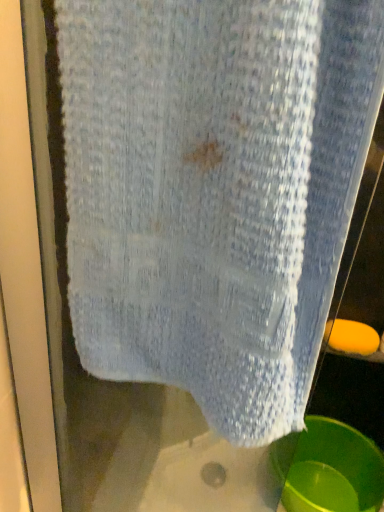
Question: Is point (312, 464) closer or farther from the camera than point (331, 326)?

Choices:
 (A) farther
 (B) closer

Answer: (A)

Question: Choose the correct answer: Is green plastic basin at lower right inside orange matte soap at lower right or outside it?

Choices:
 (A) inside
 (B) outside

Answer: (B)

Question: Looking at the image, does green plastic basin at lower right seem bigger or smaller compared to orange matte soap at lower right?

Choices:
 (A) small
 (B) big

Answer: (B)

Question: From the image's perspective, relative to green plastic basin at lower right, is orange matte soap at lower right above or below?

Choices:
 (A) above
 (B) below

Answer: (A)

Question: Looking at their shapes, would you say orange matte soap at lower right is wider or thinner than green plastic basin at lower right?

Choices:
 (A) wide
 (B) thin

Answer: (B)

Question: Looking at the image, does orange matte soap at lower right seem bigger or smaller compared to green plastic basin at lower right?

Choices:
 (A) small
 (B) big

Answer: (A)

Question: In the image, is orange matte soap at lower right positioned in front of or behind green plastic basin at lower right?

Choices:
 (A) front
 (B) behind

Answer: (B)